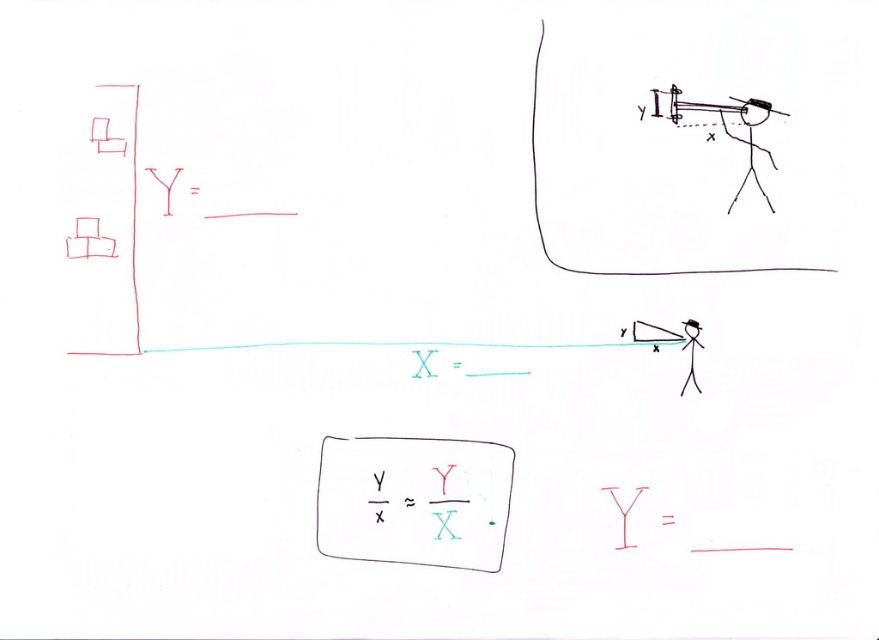
You are an astronomer trying to observe the white paper rectangle at center and the matte black telescope at upper right through a small telescope. Which object would require adjusting the telescope to a higher magnification to see details clearly?

The white paper rectangle at center is taller than the matte black telescope at upper right, so it would require higher magnification to see details clearly because it is larger in size.

You are an astronomer trying to observe the red lines and squares in the diagram. You have a white paper rectangle at center and a matte black telescope at upper right. Which tool would you use to cover the entire structure on the left side of the diagram?

The white paper rectangle at center has a larger size compared to matte black telescope at upper right, so you should use the white paper rectangle at center to cover the entire structure on the left side of the diagram.

You are an observer looking at the diagram. There are two points labeled point (452, 564) and point (657, 93). Which point is closer to you?

Point (657, 93) is closer to you because it is less further than point (452, 564).